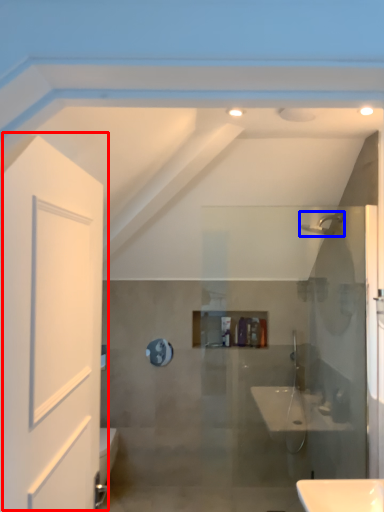
Question: Which object appears closest to the camera in this image, door (highlighted by a red box) or shower (highlighted by a blue box)?

Choices:
 (A) door
 (B) shower

Answer: (A)